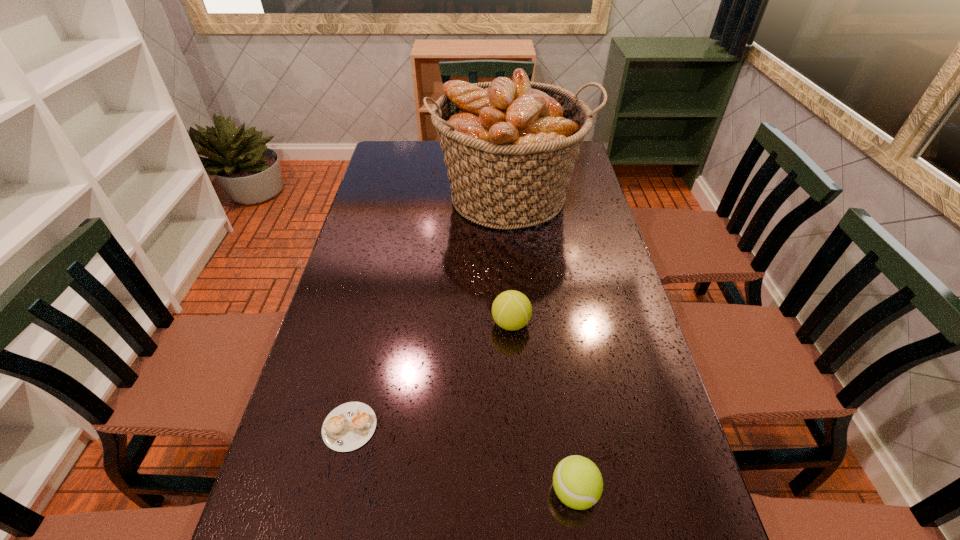
The height and width of the screenshot is (540, 960). In order to click on the tallest object in this screenshot , I will do `click(509, 147)`.

Locate an element on the screen. The image size is (960, 540). basket is located at coordinates (509, 147).

Identify the location of the third nearest object. (511, 310).

At what (x,y) coordinates should I click in order to perform the action: click on the left tennis ball. Please return your answer as a coordinate pair (x, y). Looking at the image, I should click on (511, 310).

Identify the location of the nearer tennis ball. This screenshot has height=540, width=960. (577, 481).

Where is `the nearest object`? the nearest object is located at coordinates (577, 481).

Image resolution: width=960 pixels, height=540 pixels. Identify the location of cappuccino. (349, 426).

Find the location of `the shortest object`. the shortest object is located at coordinates (349, 426).

Find the location of a particular element. free space located on the left of the tallest object is located at coordinates (411, 197).

In order to click on vacant region located on the left of the farther tennis ball in this screenshot , I will do `click(344, 323)`.